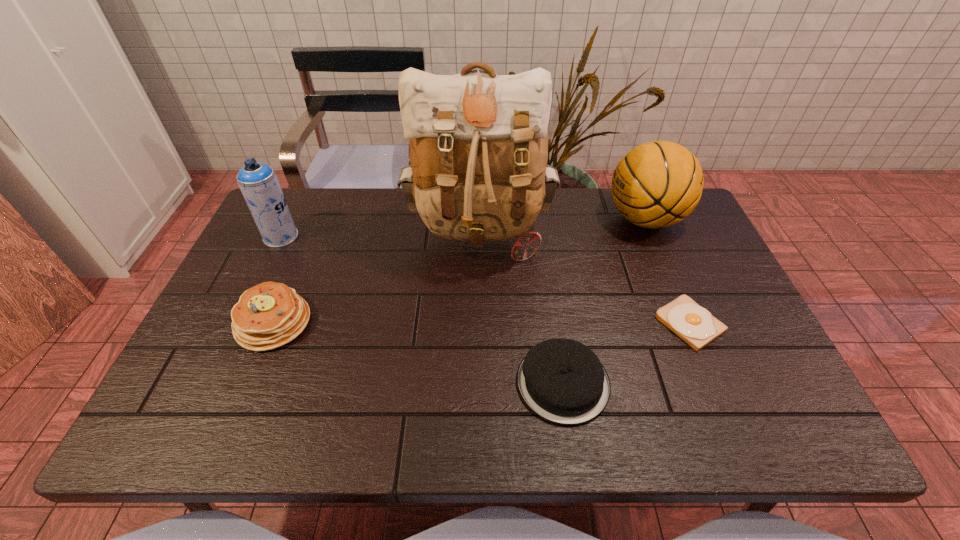
The height and width of the screenshot is (540, 960). Identify the location of free space located on the surface of the basketball near the brand logo. (572, 219).

Where is `vacant space situated on the surface of the basketball near the brand logo`? The width and height of the screenshot is (960, 540). vacant space situated on the surface of the basketball near the brand logo is located at coordinates (572, 219).

Locate an element on the screen. The height and width of the screenshot is (540, 960). vacant space located on the surface of the basketball near the brand logo is located at coordinates (563, 219).

You are a GUI agent. You are given a task and a screenshot of the screen. Output one action in this format:
    pyautogui.click(x=<x>, y=<y>)
    Task: Click on the free space located on the front of the third shortest object
    The image size is (960, 540).
    Given the screenshot: What is the action you would take?
    pyautogui.click(x=250, y=380)

The width and height of the screenshot is (960, 540). What are the coordinates of `free region located 0.340m on the left of the right pancake` in the screenshot? It's located at (362, 383).

I want to click on vacant space situated 0.110m on the left of the toast, so click(612, 323).

Where is `backpack present at the far edge`? Image resolution: width=960 pixels, height=540 pixels. backpack present at the far edge is located at coordinates (478, 141).

In order to click on aerosol can located in the far edge section of the desktop in this screenshot , I will do click(x=258, y=182).

Where is `basketball situated at the far edge`? basketball situated at the far edge is located at coordinates [x=657, y=184].

Where is `object situated at the near edge`? The width and height of the screenshot is (960, 540). object situated at the near edge is located at coordinates (563, 381).